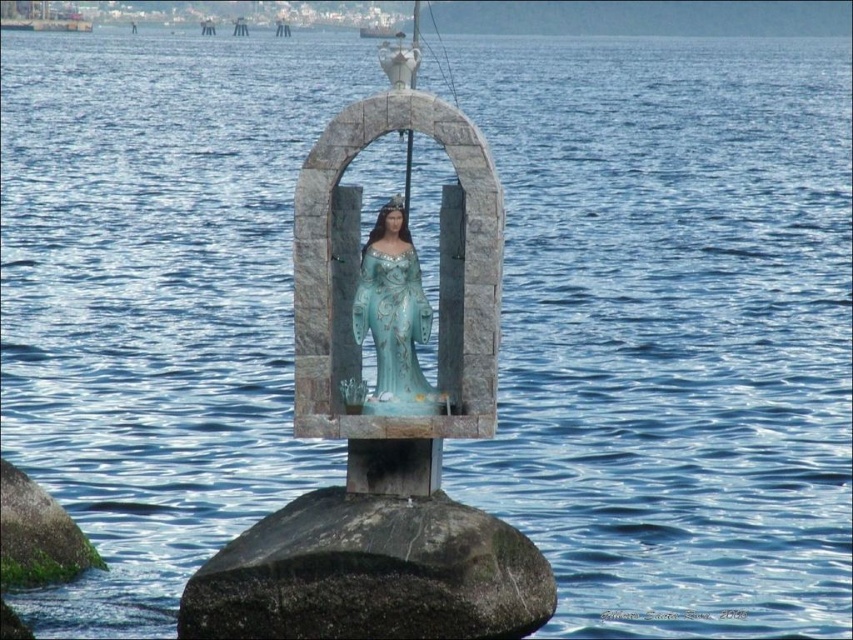
Question: Can you confirm if dark gray stone at center is wider than turquoise glossy statue at center?

Choices:
 (A) yes
 (B) no

Answer: (A)

Question: Is dark gray stone at center in front of turquoise glossy statue at center?

Choices:
 (A) no
 (B) yes

Answer: (B)

Question: Based on their relative distances, which object is nearer to the blue glossy statue at center?

Choices:
 (A) green mossy rock at lower left
 (B) dark gray stone at center
 (C) turquoise glossy statue at center

Answer: (B)

Question: Estimate the real-world distances between objects in this image. Which object is closer to the dark gray stone at center?

Choices:
 (A) blue glossy statue at center
 (B) green mossy rock at lower left

Answer: (A)

Question: Does turquoise glossy statue at center appear under green mossy rock at lower left?

Choices:
 (A) yes
 (B) no

Answer: (B)

Question: Which of the following is the closest to the observer?

Choices:
 (A) dark gray stone at center
 (B) turquoise glossy statue at center
 (C) green mossy rock at lower left
 (D) blue glossy statue at center

Answer: (A)